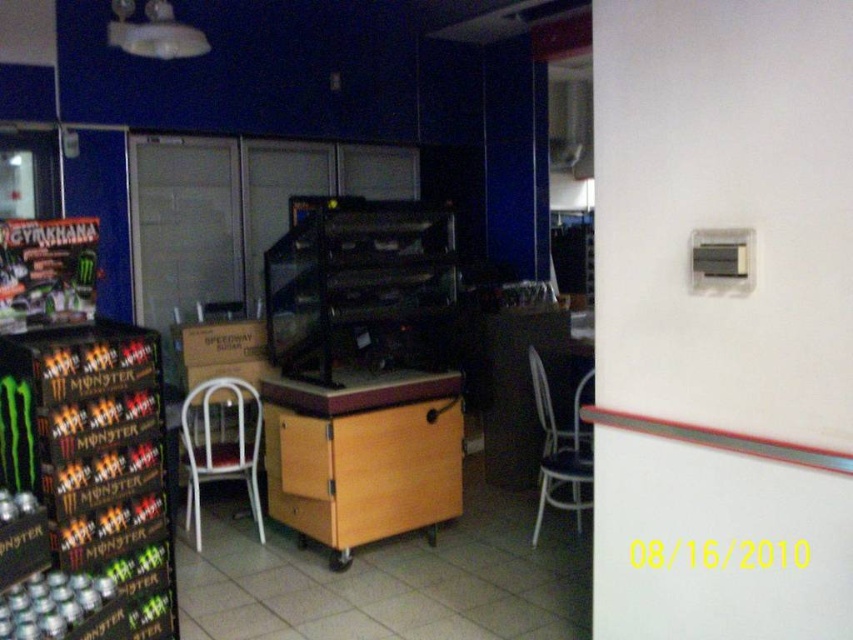
Does point (318, 484) lie behind point (195, 525)?

No, it is in front of (195, 525).

Does wooden table at center have a lesser height compared to white metal chair at left?

Incorrect, wooden table at center's height does not fall short of white metal chair at left's.

Is point (340, 561) positioned before point (248, 474)?

Yes, point (340, 561) is closer to viewer.

Where is `wooden table at center`? This screenshot has width=853, height=640. wooden table at center is located at coordinates (363, 456).

Does white metal chair at left come in front of white metal chair at center?

No, white metal chair at left is further to the viewer.

Which is above, white metal chair at left or white metal chair at center?

white metal chair at center is above.

Is point (247, 396) farther from viewer compared to point (584, 476)?

Yes, it is behind point (584, 476).

At what (x,y) coordinates should I click in order to perform the action: click on white metal chair at left. Please return your answer as a coordinate pair (x, y). Looking at the image, I should click on (221, 445).

Does wooden table at center have a larger size compared to white metal chair at center?

Incorrect, wooden table at center is not larger than white metal chair at center.

Who is more forward, (345,525) or (584,436)?

Positioned in front is point (345,525).

Who is more distant from viewer, (308,460) or (561,460)?

The point (561,460) is more distant.

Identify the location of wooden table at center. The image size is (853, 640). (363, 456).